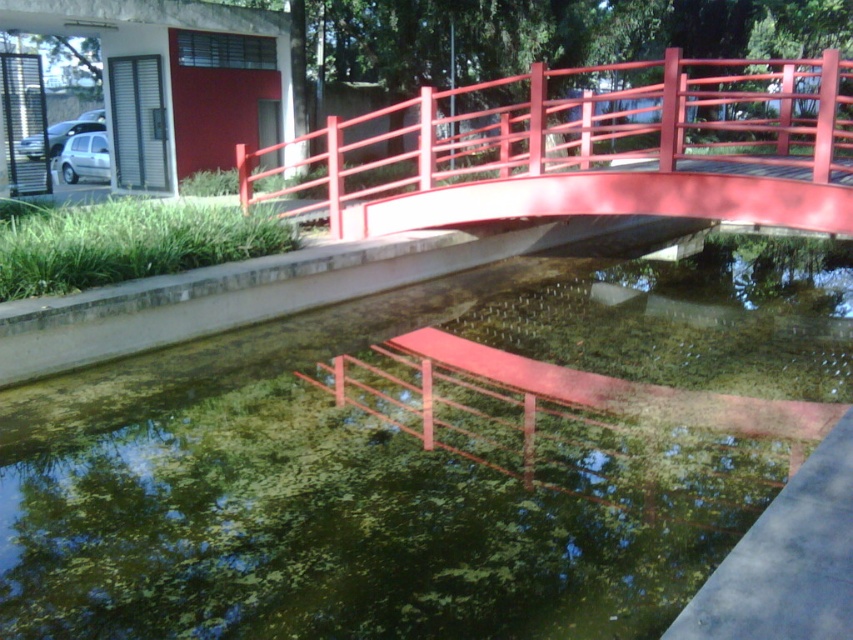
Question: Among these points, which one is nearest to the camera?

Choices:
 (A) (577, 573)
 (B) (572, 196)
 (C) (289, 234)

Answer: (A)

Question: Which of the following is the farthest from the observer?

Choices:
 (A) green algae-covered pond at center
 (B) green leafy algae at lower left

Answer: (B)

Question: Does green algae-covered pond at center appear under glossy metal bridge at upper center?

Choices:
 (A) no
 (B) yes

Answer: (B)

Question: Can you confirm if green algae-covered pond at center is bigger than glossy metal bridge at upper center?

Choices:
 (A) yes
 (B) no

Answer: (B)

Question: Which is nearer to the green algae-covered pond at center?

Choices:
 (A) glossy metal bridge at upper center
 (B) green leafy algae at lower left

Answer: (B)

Question: Considering the relative positions of glossy metal bridge at upper center and green leafy algae at lower left in the image provided, where is glossy metal bridge at upper center located with respect to green leafy algae at lower left?

Choices:
 (A) below
 (B) above

Answer: (B)